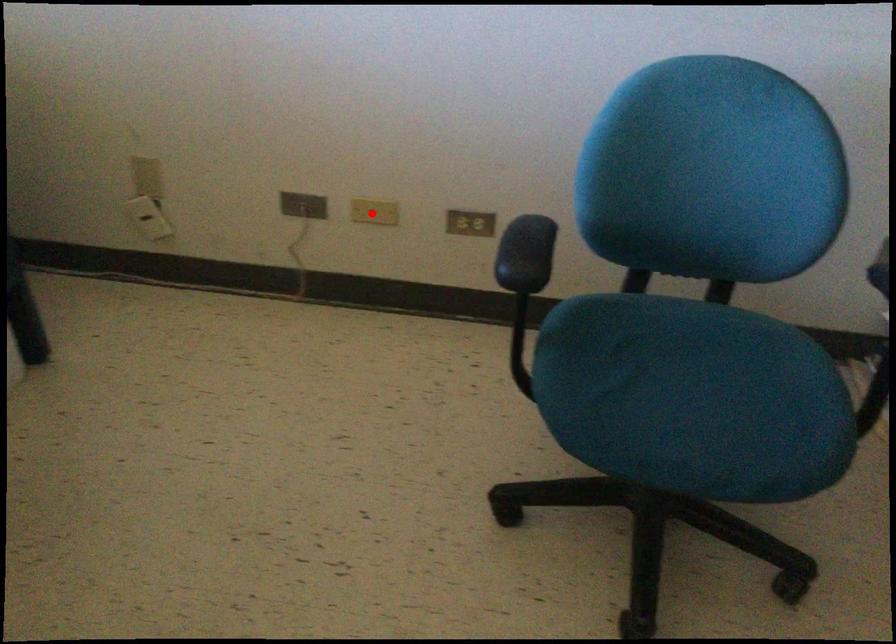
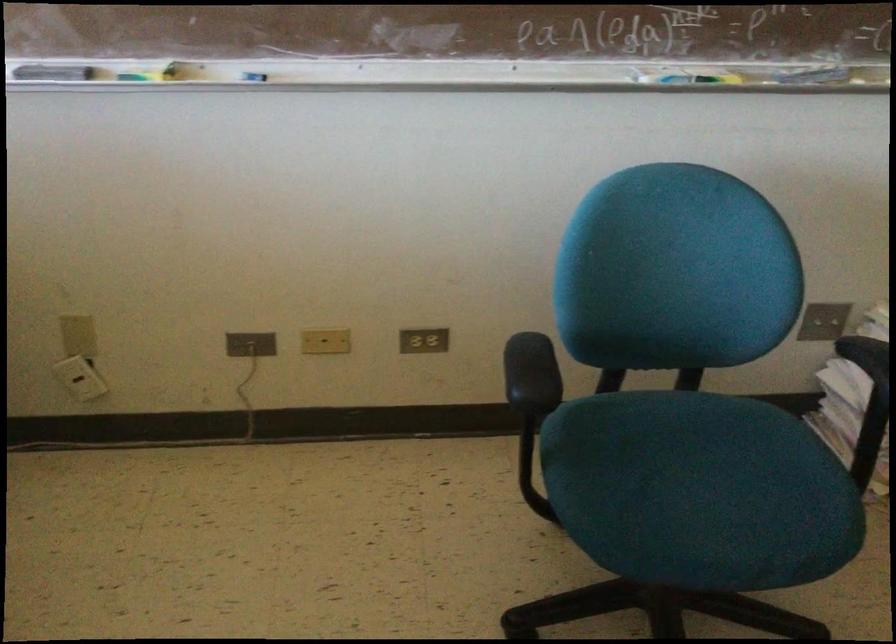
Where in the second image is the point corresponding to the highlighted location from the first image?

(325, 341)